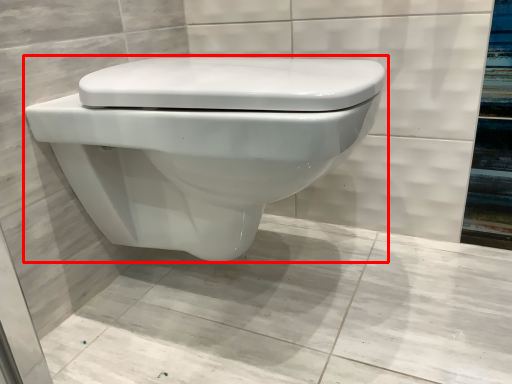
Question: Observing the image, what is the correct spatial positioning of toilet (annotated by the red box) in reference to concrete?

Choices:
 (A) left
 (B) right

Answer: (B)